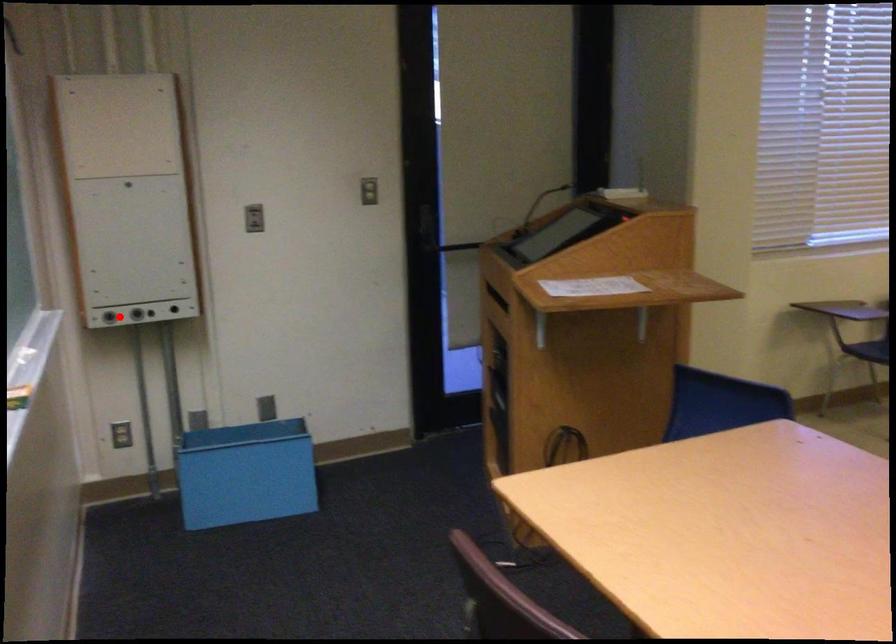
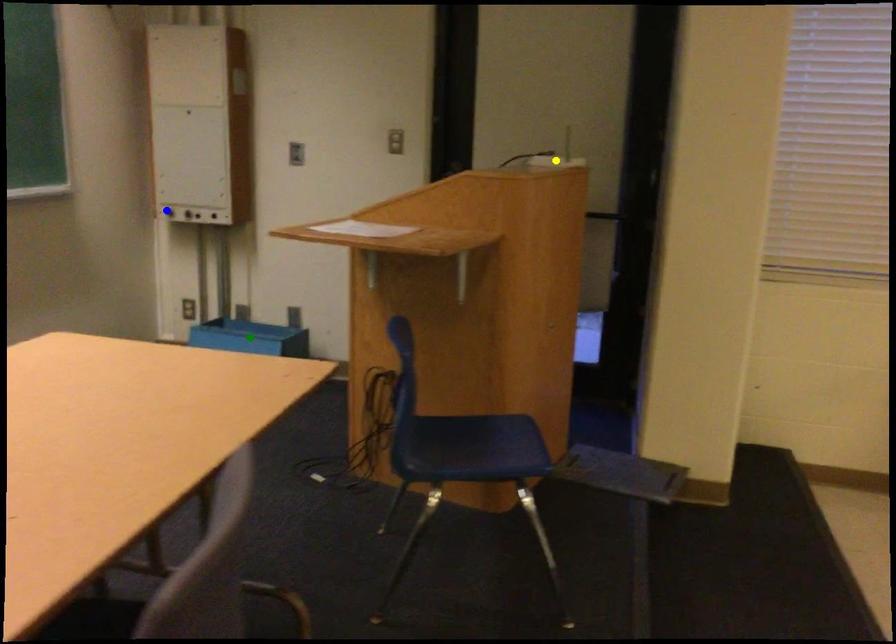
Question: I am providing you with two images of the same scene from different viewpoints. A red point is marked on the first image. You are given multiple points on the second image. Which point in image 2 is actually the same real-world point as the red point in image 1?

Choices:
 (A) blue point
 (B) green point
 (C) yellow point

Answer: (A)